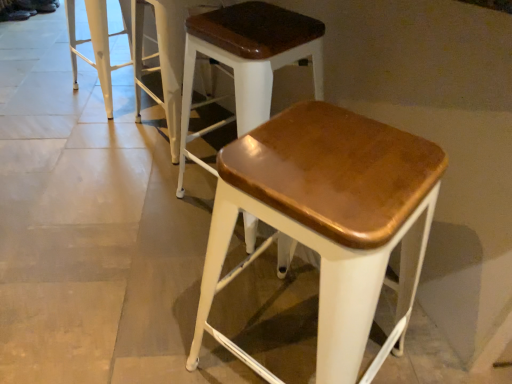
Question: From a real-world perspective, relative to matte brown wood stool at center, which ranks as the 4th stool in left-to-right order, is wooden seat stool at center, the third stool from the right, vertically above or below?

Choices:
 (A) below
 (B) above

Answer: (A)

Question: Looking at the image, does wooden seat stool at center, the second stool in the left-to-right sequence, seem bigger or smaller compared to matte brown wood stool at center, which ranks as the 4th stool in left-to-right order?

Choices:
 (A) big
 (B) small

Answer: (B)

Question: Which object is positioned farthest from the white metal stool at upper left, which is counted as the 4th stool, starting from the right?

Choices:
 (A) wooden seat stool at center, the third stool from the right
 (B) matte brown wood stool at center, the 3th stool positioned from the left
 (C) matte brown wood stool at center, which ranks as the 4th stool in left-to-right order

Answer: (C)

Question: Estimate the real-world distances between objects in this image. Which object is farther from the matte brown wood stool at center, marked as the 1th stool in a right-to-left arrangement?

Choices:
 (A) white metal stool at upper left, which is counted as the 4th stool, starting from the right
 (B) matte brown wood stool at center, which ranks as the second stool in right-to-left order
 (C) wooden seat stool at center, the third stool from the right

Answer: (A)